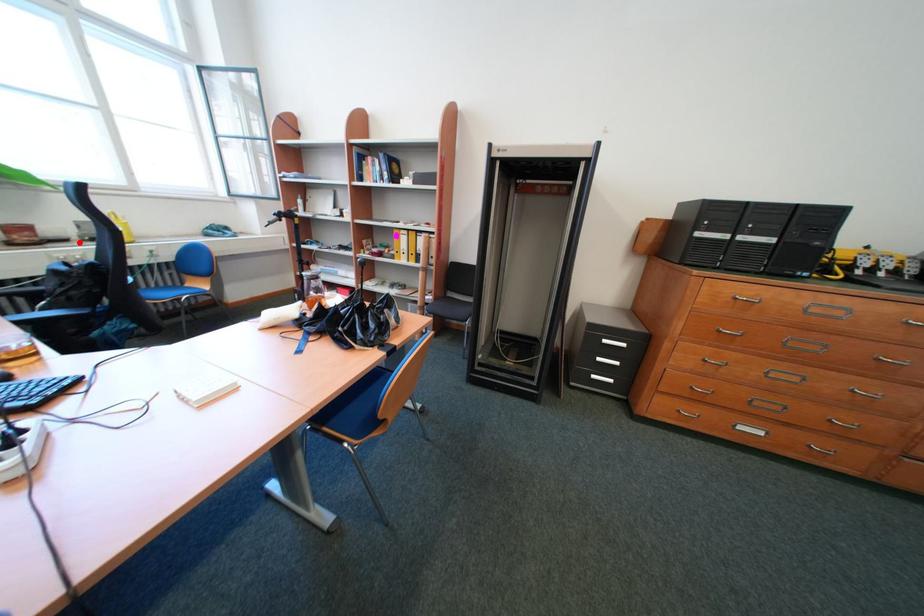
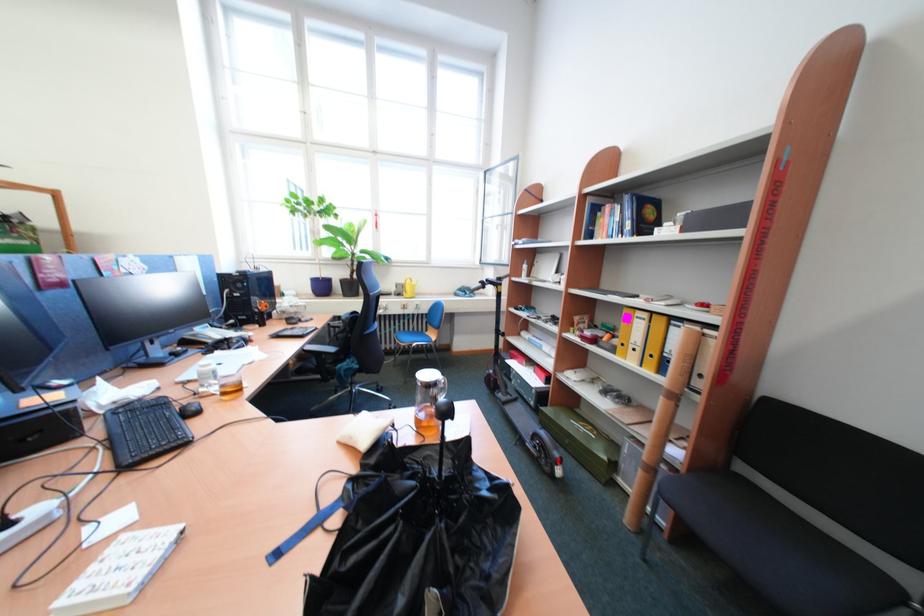
Question: I am providing you with two images of the same scene from different viewpoints. Given a red point in image1, look at the same physical point in image2. Is it:

Choices:
 (A) Closer to the viewpoint
 (B) Farther from the viewpoint

Answer: (A)